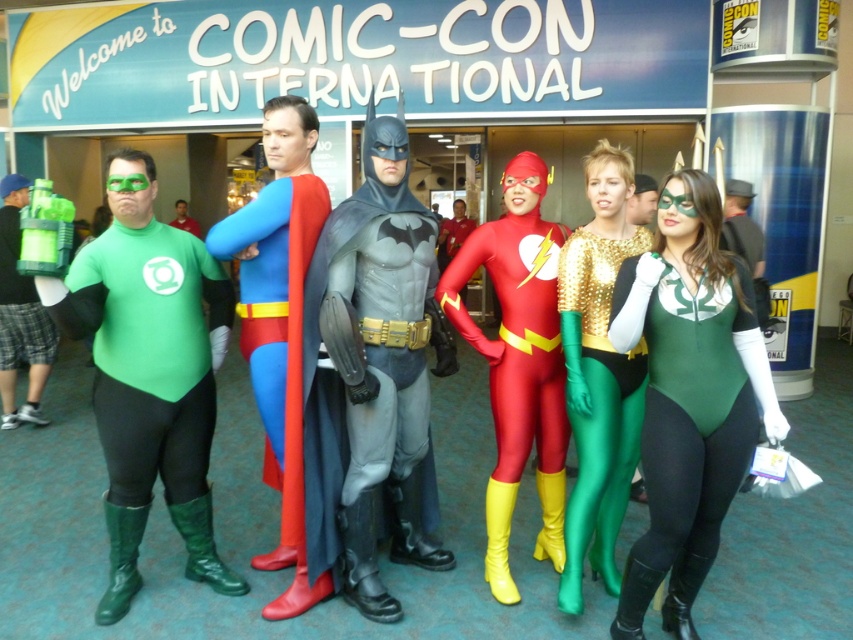
Question: Does green spandex bodysuit at center lie behind matte green backpack at left?

Choices:
 (A) no
 (B) yes

Answer: (A)

Question: Which of the following is the farthest from the observer?

Choices:
 (A) (148, 340)
 (B) (717, 512)

Answer: (A)

Question: Which point is closer to the camera?

Choices:
 (A) matte green backpack at left
 (B) shiny red spandex suit at center

Answer: (B)

Question: Is green spandex bodysuit at center above shiny gold bodysuit at center?

Choices:
 (A) no
 (B) yes

Answer: (A)

Question: Is the position of green spandex bodysuit at center less distant than that of smooth gray suit at center?

Choices:
 (A) no
 (B) yes

Answer: (B)

Question: Based on their relative distances, which object is farther from the green spandex bodysuit at center?

Choices:
 (A) matte green backpack at left
 (B) shiny gold bodysuit at center
 (C) green matte/satin bodysuit at left
 (D) green matte costume at center

Answer: (D)